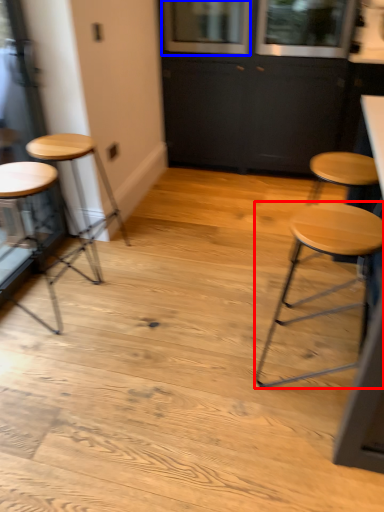
Question: Which object appears closest to the camera in this image, stool (highlighted by a red box) or window (highlighted by a blue box)?

Choices:
 (A) stool
 (B) window

Answer: (A)